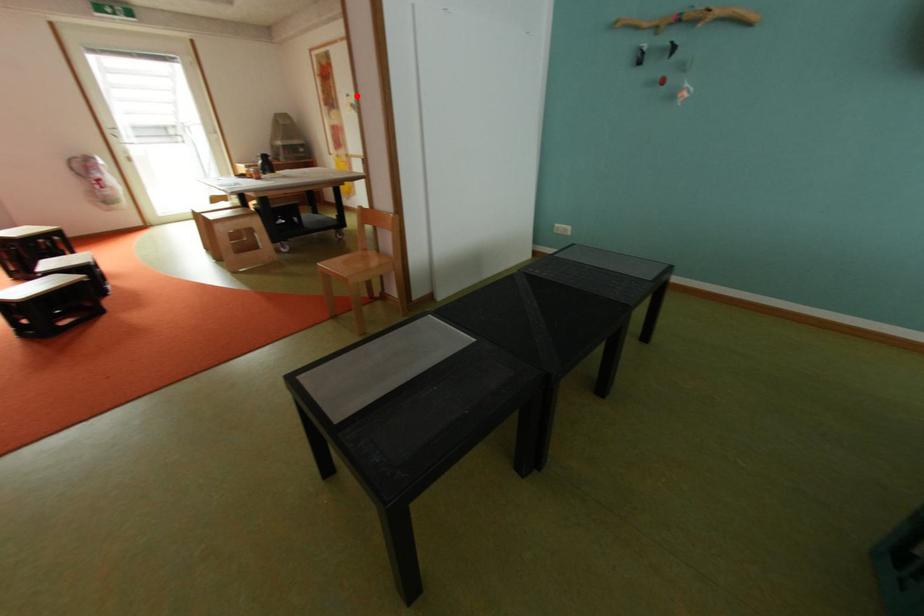
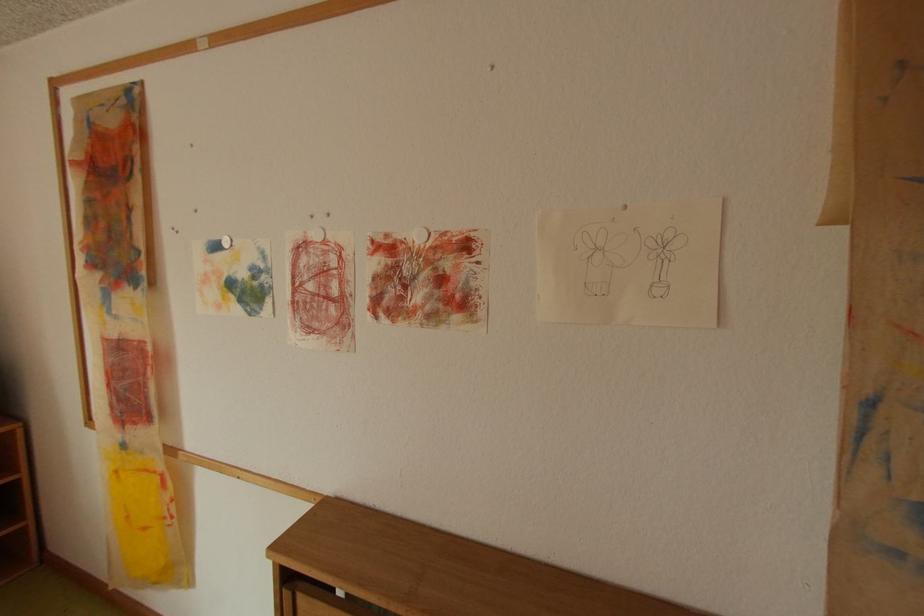
In the second image, find the point that corresponds to the highlighted location in the first image.

(225, 246)